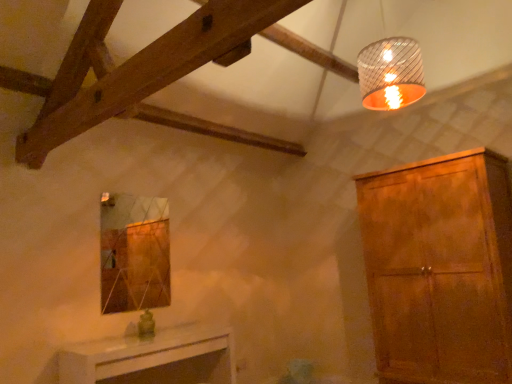
Question: From the image's perspective, relative to white glossy table at lower center, is matte brown cabinet at right above or below?

Choices:
 (A) below
 (B) above

Answer: (B)

Question: Is point (365, 187) positioned closer to the camera than point (101, 370)?

Choices:
 (A) farther
 (B) closer

Answer: (A)

Question: Which object is positioned farthest from the metallic ribbed lampshade at upper right?

Choices:
 (A) white glossy table at lower center
 (B) matte brown cabinet at right

Answer: (A)

Question: Which object is the farthest from the metallic ribbed lampshade at upper right?

Choices:
 (A) matte brown cabinet at right
 (B) white glossy table at lower center

Answer: (B)